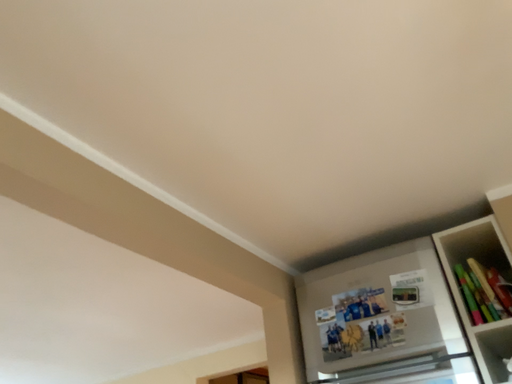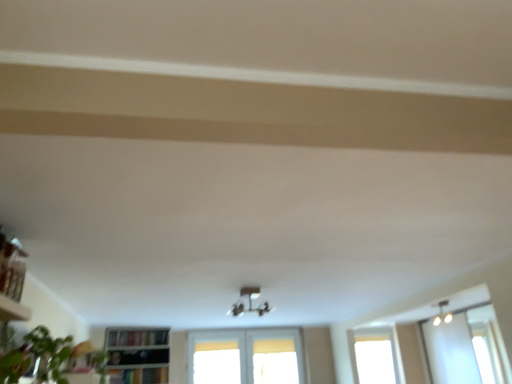
Question: Which way did the camera rotate in the video?

Choices:
 (A) rotated downward
 (B) rotated upward

Answer: (A)